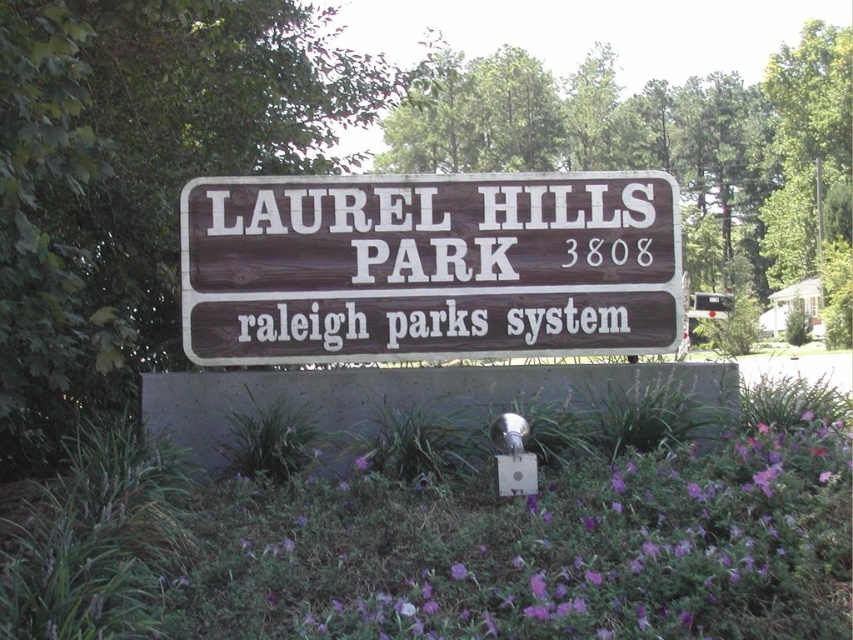
Question: Does brown wood sign at center have a smaller size compared to purple matte flower at center?

Choices:
 (A) yes
 (B) no

Answer: (B)

Question: Which point is closer to the camera?

Choices:
 (A) (242, 269)
 (B) (463, 573)

Answer: (B)

Question: Can you confirm if brown wood sign at center is bigger than purple matte flower at center?

Choices:
 (A) no
 (B) yes

Answer: (B)

Question: Is brown wood sign at center to the left of purple matte flower at center from the viewer's perspective?

Choices:
 (A) yes
 (B) no

Answer: (A)